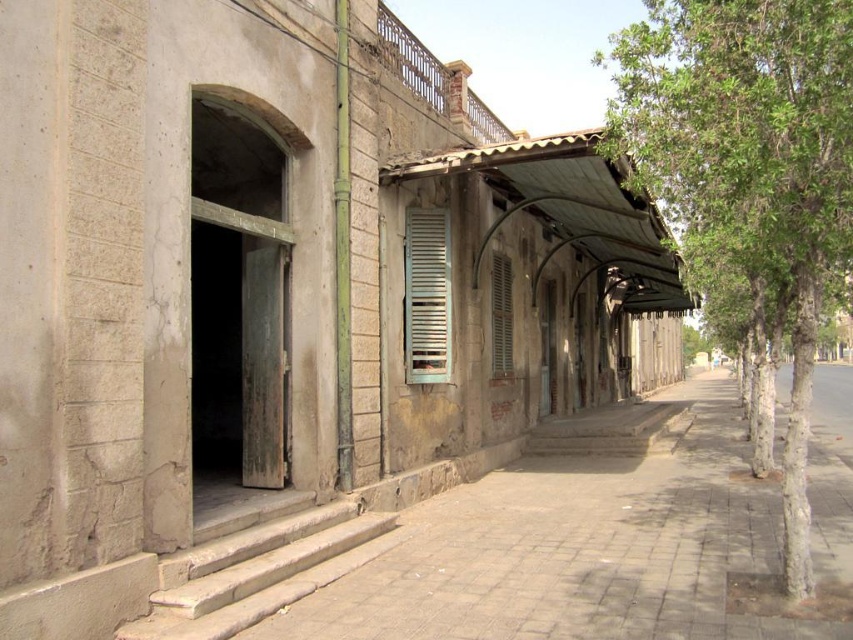
Who is positioned more to the left, brown brick pavement at center or silver metallic shutter at center?

From the viewer's perspective, silver metallic shutter at center appears more on the left side.

Between point (483, 636) and point (445, 275), which one is positioned behind?

Positioned behind is point (445, 275).

The height and width of the screenshot is (640, 853). Find the location of `brown brick pavement at center`. brown brick pavement at center is located at coordinates (577, 550).

Which is behind, point (670, 506) or point (498, 353)?

Point (498, 353)

Is point (509, 525) in front of point (502, 376)?

That is True.

Where is `brown brick pavement at center`? The width and height of the screenshot is (853, 640). brown brick pavement at center is located at coordinates (577, 550).

Can you confirm if brown brick pavement at center is shorter than green leafy tree at right?

Yes.

The image size is (853, 640). What do you see at coordinates (577, 550) in the screenshot?
I see `brown brick pavement at center` at bounding box center [577, 550].

Locate an element on the screen. The image size is (853, 640). brown brick pavement at center is located at coordinates (577, 550).